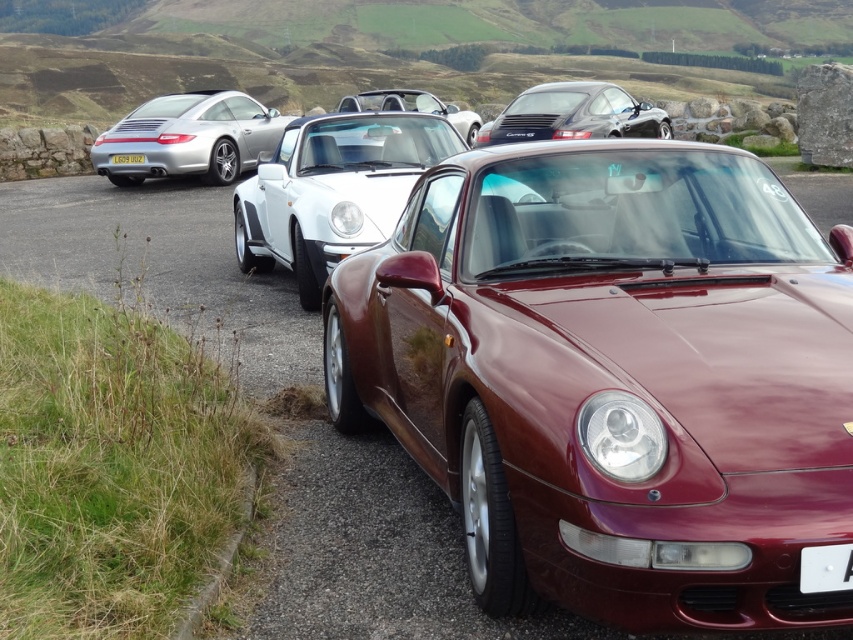
Identify the location of satin silver car at left. The width and height of the screenshot is (853, 640). (189, 138).

Between satin silver car at left and white matte convertible at center, which one is positioned lower?

Positioned lower is satin silver car at left.

Find the location of a particular element. The height and width of the screenshot is (640, 853). satin silver car at left is located at coordinates (189, 138).

Which is above, satin silver car at left or satin black porsche at center?

satin silver car at left is higher up.

Does satin silver car at left have a smaller size compared to satin black porsche at center?

Correct, satin silver car at left occupies less space than satin black porsche at center.

The height and width of the screenshot is (640, 853). Describe the element at coordinates (189, 138) in the screenshot. I see `satin silver car at left` at that location.

This screenshot has height=640, width=853. In order to click on satin silver car at left in this screenshot , I will do `click(189, 138)`.

Between point (196, 172) and point (123, 156), which one is positioned in front?

Point (123, 156) is in front.

Does satin silver car at left have a lesser width compared to yellow metallic license plate at center?

Incorrect, satin silver car at left's width is not less than yellow metallic license plate at center's.

Find the location of `satin silver car at left`. satin silver car at left is located at coordinates (189, 138).